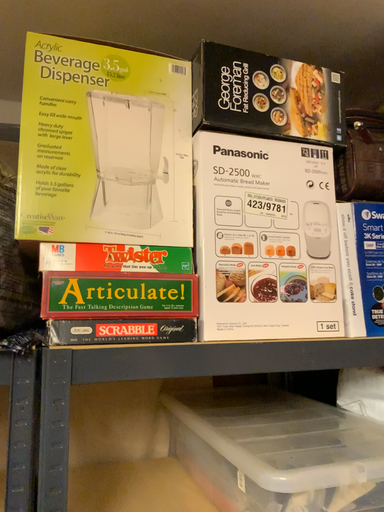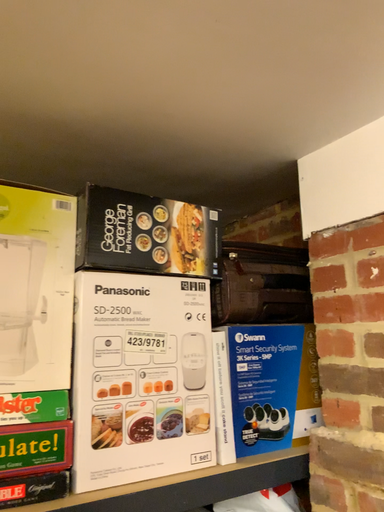
Question: How did the camera likely rotate when shooting the video?

Choices:
 (A) rotated left
 (B) rotated right

Answer: (B)